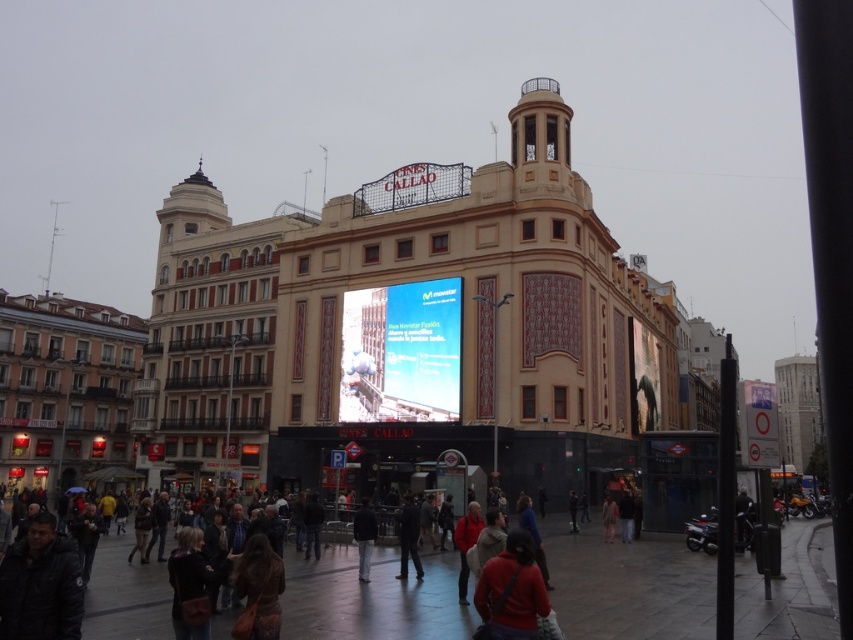
You are a photographer standing in front of the Cines Callao building. You notice a matte black billboard at center and a person wearing a red jacket at center. Which object is taller?

The matte black billboard at center is taller than the red jacket at center.

Consider the image. You are a photographer standing in the bustling urban scene at Cines Callao. You notice two people wearing jackets. One is wearing a dark gray jacket at lower left, and the other is wearing a red jacket at center. Which person is taller?

The dark gray jacket at lower left is much taller than the red jacket at center, so the person wearing the dark gray jacket at lower left is taller.

You are a photographer standing in the middle of the bustling scene. You want to capture a photo that includes both the matte black billboard at center and the red jacket at center. Since you want the billboard to be the main focus, which object should you position closer to the front of the frame?

The matte black billboard at center is bigger than the red jacket at center, so to make the billboard the main focus, position the red jacket at center closer to the front of the frame. This way, the smaller jacket will draw attention while the larger billboard remains prominent in the background.